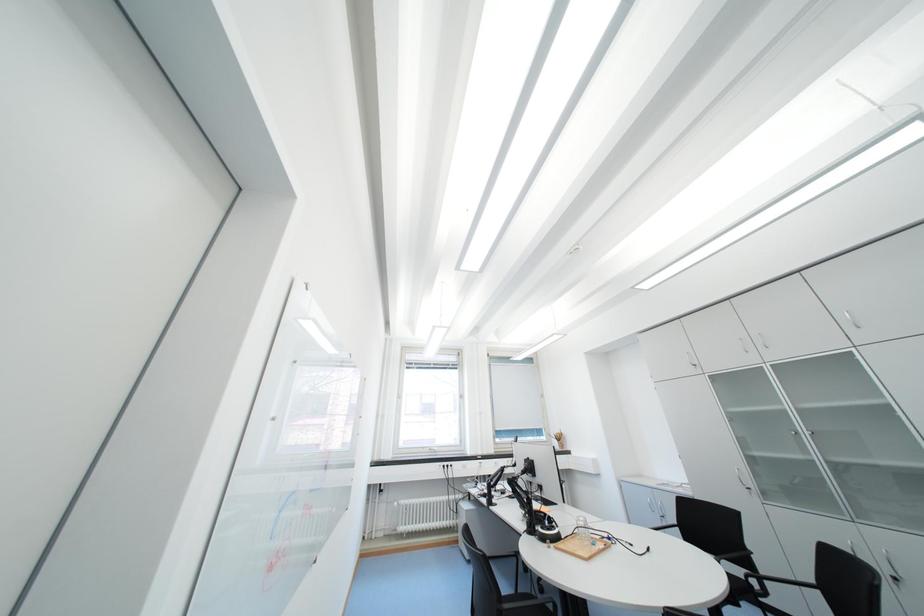
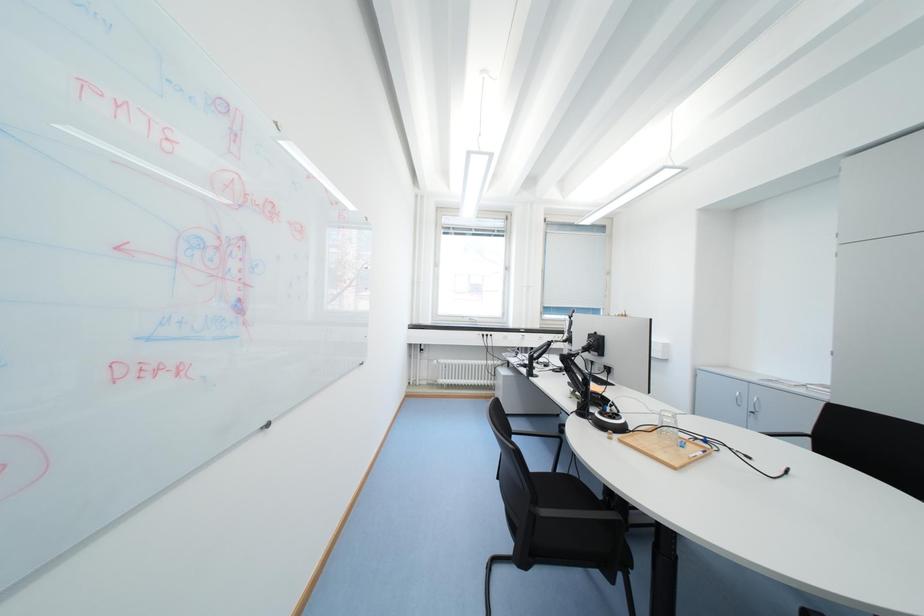
Question: Based on the continuous images, in which direction is the camera rotating? Reply with the corresponding letter.

Choices:
 (A) Left
 (B) Right
 (C) Up
 (D) Down

Answer: (D)